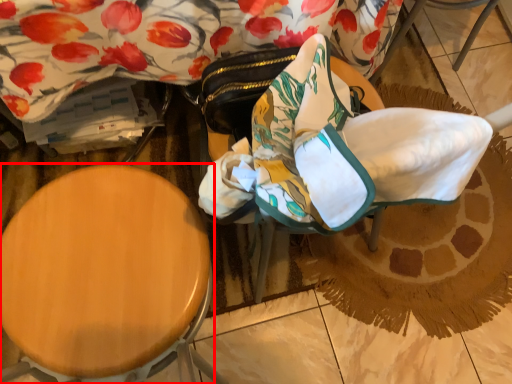
Question: Where is furniture (annotated by the red box) located in relation to swivel chair in the image?

Choices:
 (A) right
 (B) left

Answer: (B)